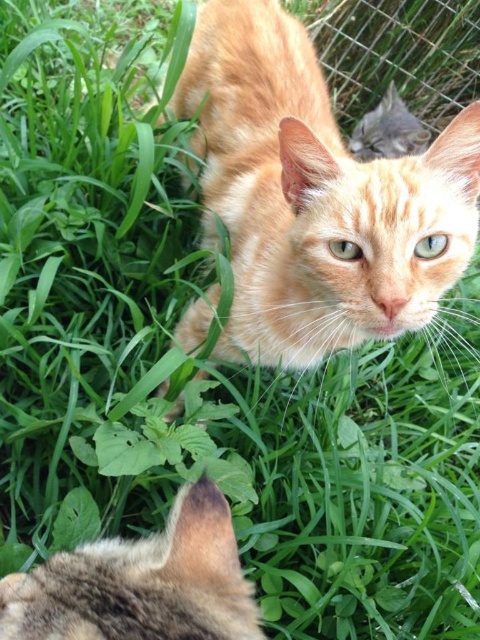
The height and width of the screenshot is (640, 480). I want to click on orange fur cat at center, so click(314, 196).

Which is more to the right, orange fur cat at center or tabby fur ear at lower left?

From the viewer's perspective, orange fur cat at center appears more on the right side.

Between point (188, 348) and point (79, 557), which one is positioned behind?

Positioned behind is point (188, 348).

Locate an element on the screen. orange fur cat at center is located at coordinates (314, 196).

Is tabby fur ear at lower left positioned in front of metallic wire fence at upper right?

That is True.

Between point (60, 579) and point (447, 36), which one is positioned in front?

Positioned in front is point (60, 579).

At what (x,y) coordinates should I click in order to perform the action: click on tabby fur ear at lower left. Please return your answer as a coordinate pair (x, y). Looking at the image, I should click on (141, 582).

Does orange fur cat at center have a greater height compared to metallic wire fence at upper right?

Yes.

How much distance is there between orange fur cat at center and metallic wire fence at upper right?

orange fur cat at center and metallic wire fence at upper right are 1.10 meters apart from each other.

The width and height of the screenshot is (480, 640). What are the coordinates of `orange fur cat at center` in the screenshot? It's located at (314, 196).